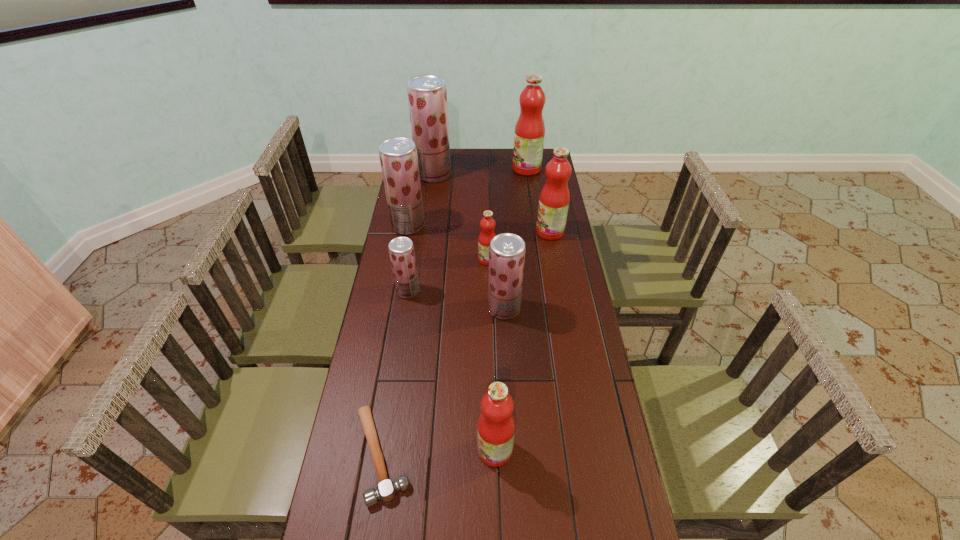
What are the coordinates of `free space located 0.220m on the front label of the nearest fruit juice` in the screenshot? It's located at (396, 450).

The image size is (960, 540). Find the location of `vacant point located on the front label of the nearest fruit juice`. vacant point located on the front label of the nearest fruit juice is located at coordinates (367, 450).

You are a GUI agent. You are given a task and a screenshot of the screen. Output one action in this format:
    pyautogui.click(x=<x>, y=<y>)
    Task: Click on the vacant space situated on the front label of the nearest fruit juice
    
    Given the screenshot: What is the action you would take?
    pyautogui.click(x=367, y=450)

Find the location of a particular element. The image size is (960, 540). vacant position located on the front label of the fourth nearest fruit juice is located at coordinates (430, 260).

Find the location of a particular element. The height and width of the screenshot is (540, 960). free spot located on the front label of the fourth nearest fruit juice is located at coordinates (458, 260).

Where is `free location located on the front label of the fourth nearest fruit juice`? free location located on the front label of the fourth nearest fruit juice is located at coordinates (447, 260).

This screenshot has height=540, width=960. Find the location of `free spot located on the right of the smallest strawberry fruit juice`. free spot located on the right of the smallest strawberry fruit juice is located at coordinates (439, 291).

Find the location of a particular element. The width and height of the screenshot is (960, 540). free space located 0.150m on the right of the shortest object is located at coordinates point(469,455).

Where is `hammer at the left edge`? The height and width of the screenshot is (540, 960). hammer at the left edge is located at coordinates (386, 490).

Locate an element on the screen. This screenshot has width=960, height=540. object that is at the far left corner is located at coordinates click(427, 94).